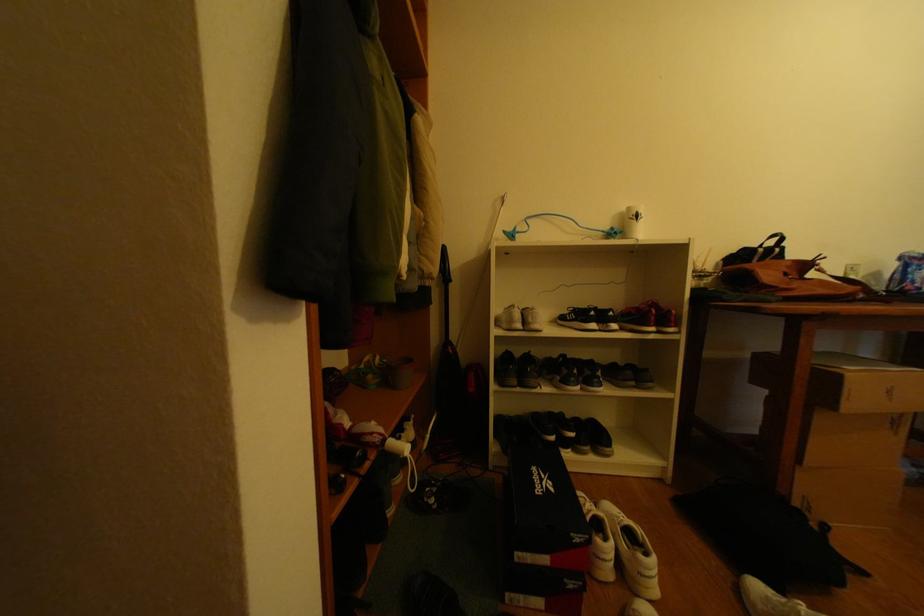
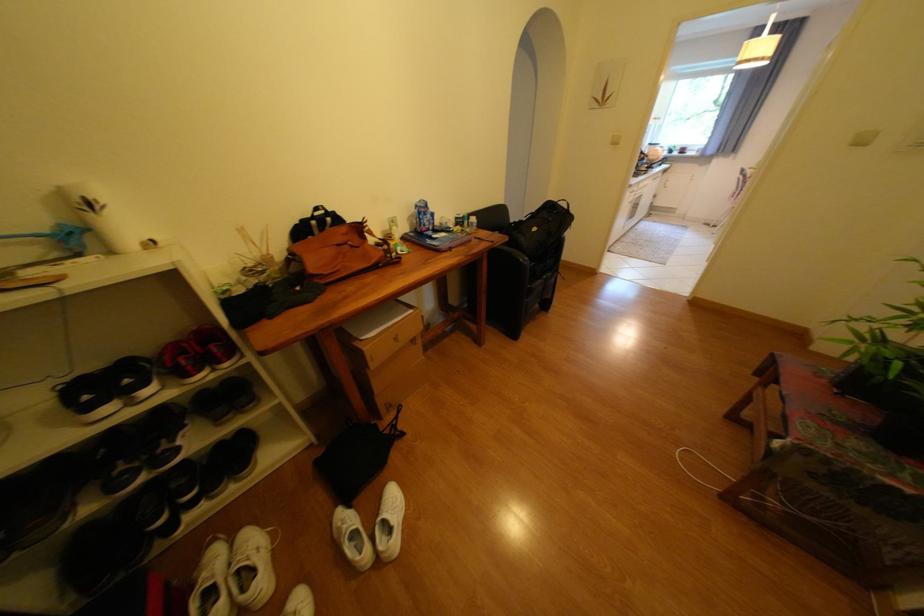
Find the pixel in the second image that matches [647,217] in the first image.

(100, 205)